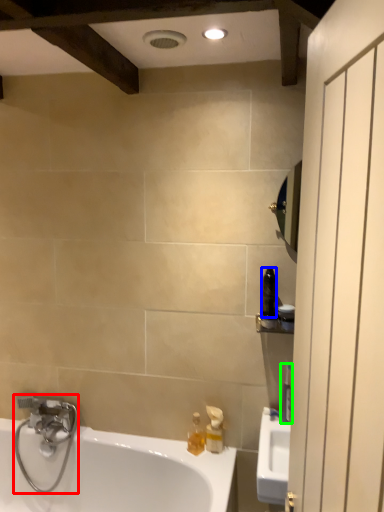
Question: Considering the real-world distances, which object is farthest from plumbing fixture (highlighted by a red box)? toiletry (highlighted by a blue box) or toiletry (highlighted by a green box)?

Choices:
 (A) toiletry
 (B) toiletry

Answer: (A)